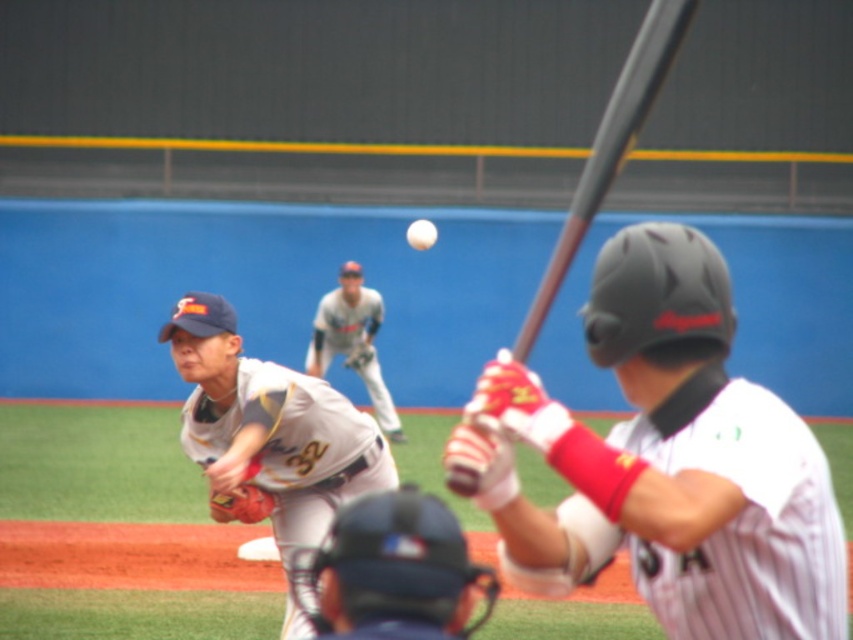
Based on the photo, who is more forward, (x=293, y=625) or (x=219, y=516)?

Point (x=293, y=625) is in front.

Which is in front, point (260, 387) or point (254, 502)?

Point (260, 387) is in front.

Find the location of a particular element. Image resolution: width=853 pixels, height=640 pixels. white uniform at center is located at coordinates (270, 426).

Does gray matte bat at upper center have a larger size compared to brown leather glove at lower left?

Yes.

Is gray matte bat at upper center to the left of brown leather glove at lower left from the viewer's perspective?

Incorrect, gray matte bat at upper center is not on the left side of brown leather glove at lower left.

Is point (688, 10) behind point (242, 500)?

No, (688, 10) is closer to viewer.

Where is `gray matte bat at upper center`? This screenshot has height=640, width=853. gray matte bat at upper center is located at coordinates (611, 145).

Can you confirm if dark blue helmet at center is positioned to the left of white matte baseball at center?

Yes, dark blue helmet at center is to the left of white matte baseball at center.

Can you confirm if dark blue helmet at center is positioned to the right of white matte baseball at center?

In fact, dark blue helmet at center is to the left of white matte baseball at center.

Which is behind, point (405, 595) or point (415, 225)?

Positioned behind is point (415, 225).

I want to click on dark blue helmet at center, so click(x=392, y=572).